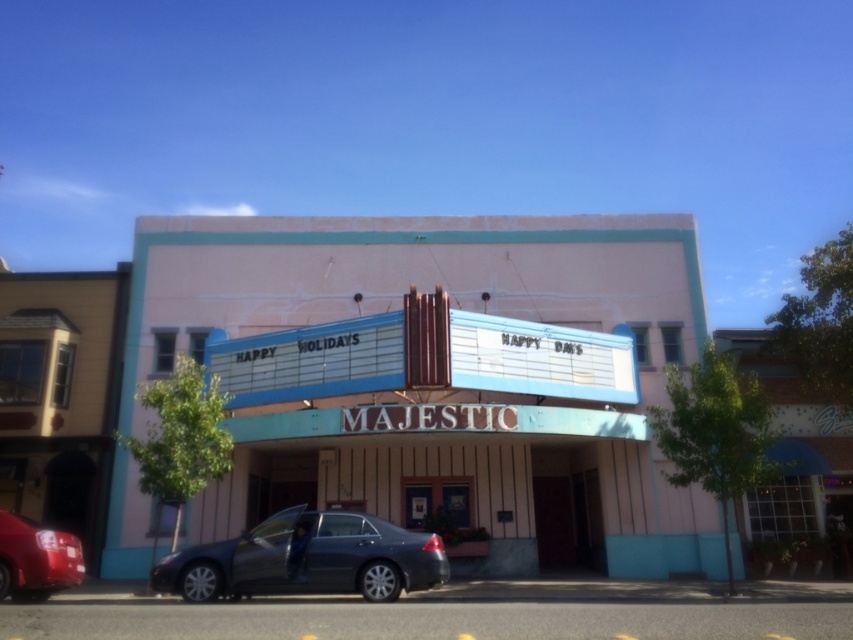
Question: Is pink painted theater at center to the right of shiny red sedan at lower left from the viewer's perspective?

Choices:
 (A) no
 (B) yes

Answer: (B)

Question: Is pink painted theater at center above shiny black sedan at center?

Choices:
 (A) no
 (B) yes

Answer: (B)

Question: Among these points, which one is farthest from the camera?

Choices:
 (A) (369, 305)
 (B) (349, 522)

Answer: (A)

Question: Which point is closer to the camera?

Choices:
 (A) (358, 564)
 (B) (401, 436)

Answer: (A)

Question: Can you confirm if pink painted theater at center is wider than shiny black sedan at center?

Choices:
 (A) yes
 (B) no

Answer: (A)

Question: Which point is farther from the camera taking this photo?

Choices:
 (A) (263, 554)
 (B) (421, 422)
 (C) (73, 552)

Answer: (B)